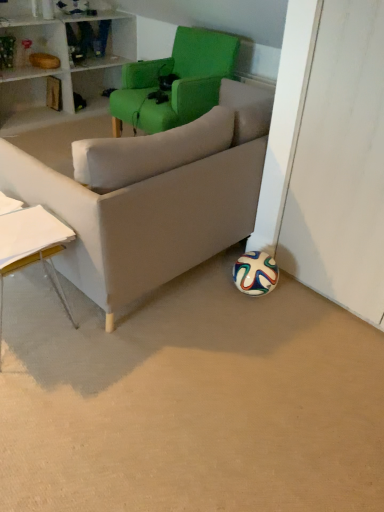
Question: Is green fabric chair at upper center taller than white paper at left?

Choices:
 (A) yes
 (B) no

Answer: (A)

Question: Considering the relative sizes of green fabric chair at upper center and white paper at left in the image provided, is green fabric chair at upper center shorter than white paper at left?

Choices:
 (A) no
 (B) yes

Answer: (A)

Question: From the image's perspective, is green fabric chair at upper center on top of white paper at left?

Choices:
 (A) yes
 (B) no

Answer: (A)

Question: Is white paper at left completely or partially inside green fabric chair at upper center?

Choices:
 (A) yes
 (B) no

Answer: (B)

Question: Is green fabric chair at upper center wider than white paper at left?

Choices:
 (A) yes
 (B) no

Answer: (A)

Question: Does green fabric chair at upper center appear on the right side of white paper at left?

Choices:
 (A) no
 (B) yes

Answer: (B)

Question: From the image's perspective, is white paper at left located beneath green fabric chair at upper center?

Choices:
 (A) yes
 (B) no

Answer: (A)

Question: Is white paper at left shorter than green fabric chair at upper center?

Choices:
 (A) yes
 (B) no

Answer: (A)

Question: Considering the relative sizes of white paper at left and green fabric chair at upper center in the image provided, is white paper at left wider than green fabric chair at upper center?

Choices:
 (A) no
 (B) yes

Answer: (A)

Question: Is green fabric chair at upper center inside white paper at left?

Choices:
 (A) no
 (B) yes

Answer: (A)

Question: Can you confirm if white paper at left is smaller than green fabric chair at upper center?

Choices:
 (A) no
 (B) yes

Answer: (B)

Question: From a real-world perspective, is white paper at left beneath green fabric chair at upper center?

Choices:
 (A) yes
 (B) no

Answer: (A)

Question: From a real-world perspective, relative to green fabric chair at upper center, is white paper at left vertically above or below?

Choices:
 (A) above
 (B) below

Answer: (B)